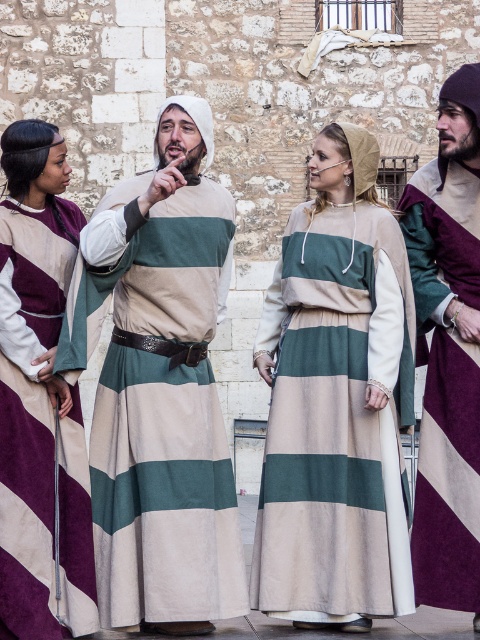
You are a photographer trying to capture the scene with a camera. You want to focus on both point (180, 410) and point (403, 589). Which point is closer to your camera lens?

Point (180, 410) is further to the camera than point (403, 589), so the point closer to the camera lens is point (403, 589).

You are organizing a medieval fair and need to arrange the green striped tunic at center and the matte beige and green striped dress at center on a display stand. Which clothing item should be placed higher up to match their actual heights?

The green striped tunic at center should be placed higher up since it is taller than the matte beige and green striped dress at center.

You are a costume designer observing the medieval scene. You need to determine which costume is taller between the matte beige and green striped dress at center and the velvet purple robe at left. Based on the scene, which one is taller?

The matte beige and green striped dress at center is much taller than the velvet purple robe at left, so the dress is taller.